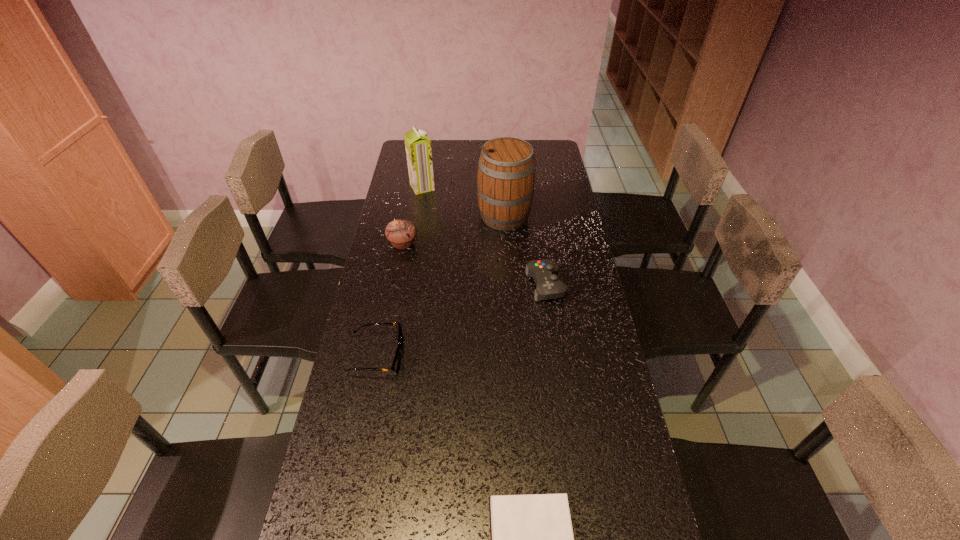
Image resolution: width=960 pixels, height=540 pixels. Identify the location of cider. (506, 169).

Where is `soya milk`? The image size is (960, 540). soya milk is located at coordinates (417, 144).

Where is `muffin`? Image resolution: width=960 pixels, height=540 pixels. muffin is located at coordinates (401, 233).

The width and height of the screenshot is (960, 540). I want to click on the fourth nearest object, so click(401, 233).

Where is `the fourth farthest object`? the fourth farthest object is located at coordinates (544, 272).

Where is `the fifth tallest object`? the fifth tallest object is located at coordinates (395, 367).

The width and height of the screenshot is (960, 540). I want to click on sunglasses, so click(x=395, y=367).

Locate an element on the screen. vacant space located 0.100m on the front of the second farthest object is located at coordinates (507, 251).

At what (x,y) coordinates should I click in order to perform the action: click on free location located on the back of the soya milk. Please return your answer as a coordinate pair (x, y). Looking at the image, I should click on (429, 146).

Where is `vacant space located 0.100m on the right of the third tallest object`? Image resolution: width=960 pixels, height=540 pixels. vacant space located 0.100m on the right of the third tallest object is located at coordinates (444, 244).